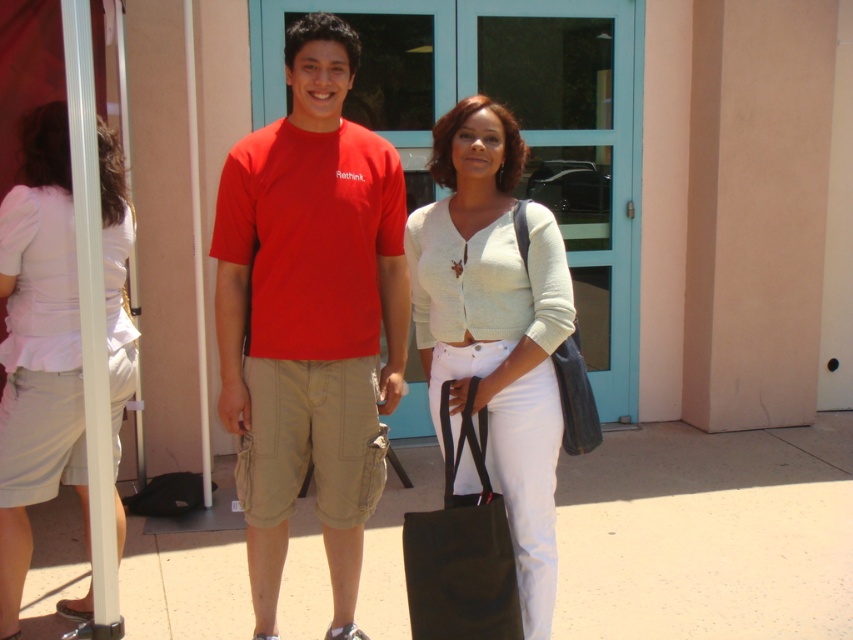
You are at the point marked as point (310, 316). What object is located exactly at this point?

The object at point (310, 316) is the matte red t shirt at center.

You are a delivery person who needs to place a package at point [9,212]. You are currently at point [521,243]. Can you walk directly to the delivery point without going around anything?

Point [9,212] is behind point [521,243], so you cannot walk directly to the delivery point without going around the obstruction.